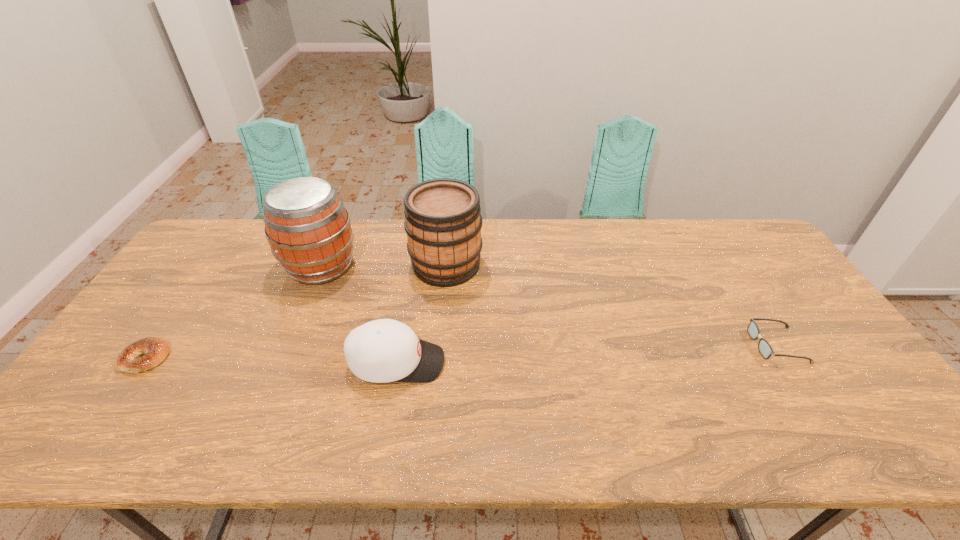
Find the location of a particular element. The image size is (960, 540). free space at the far right corner of the desktop is located at coordinates (710, 234).

Where is `unoccupied area between the baseball cap and the left cider`? unoccupied area between the baseball cap and the left cider is located at coordinates (359, 314).

The image size is (960, 540). In order to click on unoccupied area between the baseball cap and the right cider in this screenshot , I will do `click(421, 314)`.

Locate an element on the screen. vacant space that's between the shortest object and the left cider is located at coordinates (233, 312).

The width and height of the screenshot is (960, 540). Find the location of `free space that is in between the left cider and the second shortest object`. free space that is in between the left cider and the second shortest object is located at coordinates (549, 306).

Locate an element on the screen. blank region between the left cider and the rightmost object is located at coordinates (549, 306).

Identify the location of empty space that is in between the left cider and the leftmost object. This screenshot has height=540, width=960. (233, 312).

At what (x,y) coordinates should I click in order to perform the action: click on free space between the shortest object and the rightmost object. Please return your answer as a coordinate pair (x, y). The image size is (960, 540). Looking at the image, I should click on (462, 352).

What are the coordinates of `free space between the rightmost object and the second object from left to right` in the screenshot? It's located at (549, 306).

Where is `vacant space that is in between the left cider and the rightmost object`? vacant space that is in between the left cider and the rightmost object is located at coordinates (549, 306).